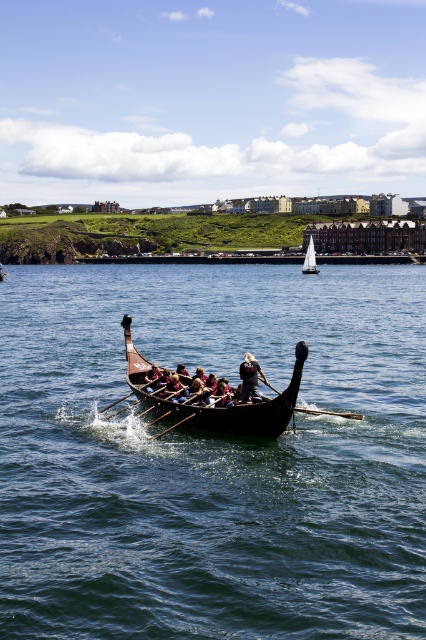
You are planning to store the dark brown leather helmet at center in the wooden dark brown canoe at center. Based on the scene description, will the helmet fit inside the canoe?

The wooden dark brown canoe at center is bigger than the dark brown leather helmet at center, so the helmet will fit inside the canoe.

You are standing on the deck of the Viking longboat in the image. There is a point at coordinates point (169, 440) that you need to reach. Can you safely walk directly to that point from your current position?

The distance between point (169, 440) and the camera is 45.21 meters, which is quite far. Since you are on the deck of the Viking longboat, you cannot walk directly to that point as it is likely located on the water or another distant area beyond the boat.